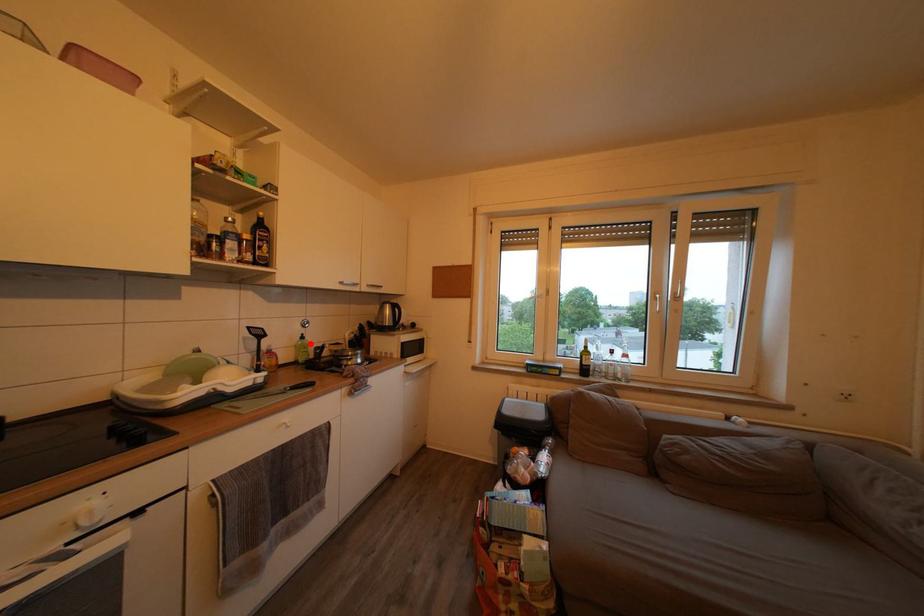
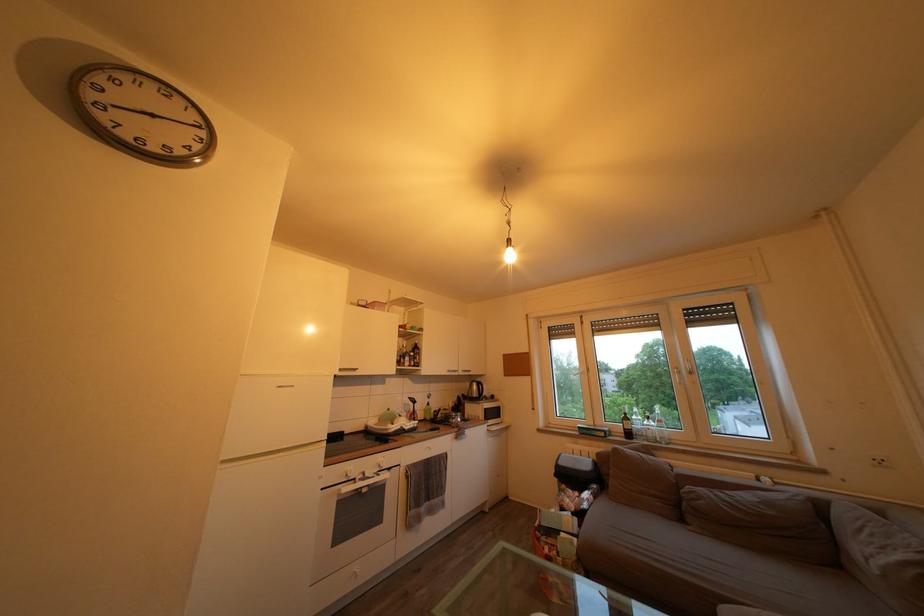
Locate, in the second image, the point that corresponds to the highlighted location in the first image.

(436, 411)